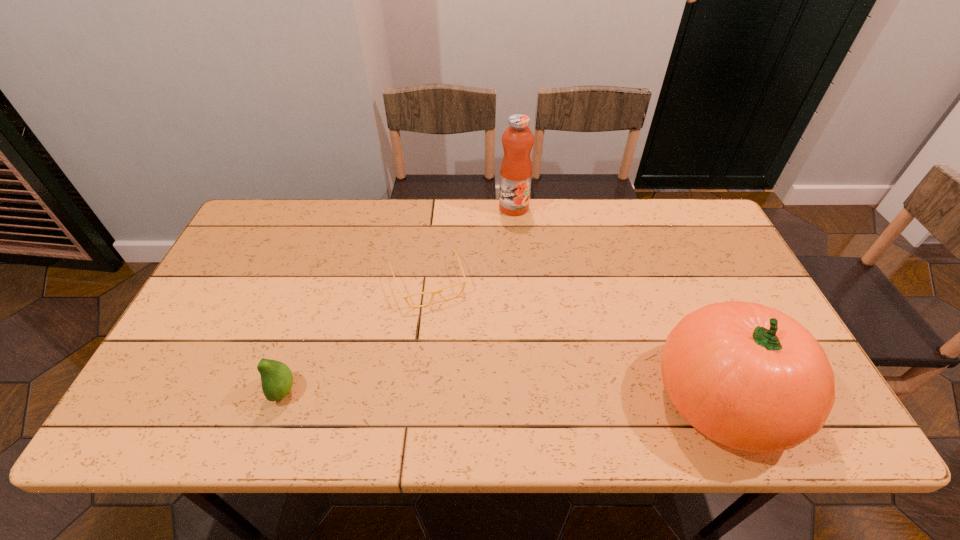
Where is `pumpkin at the near edge`? pumpkin at the near edge is located at coordinates (748, 376).

Identify the location of object positioned at the right edge. The image size is (960, 540). [748, 376].

I want to click on object situated at the near right corner, so click(748, 376).

Find the location of a particular element. The image size is (960, 540). vacant space at the far edge of the desktop is located at coordinates (407, 202).

The image size is (960, 540). In the image, there is a desktop. In order to click on vacant space at the near edge in this screenshot , I will do `click(651, 377)`.

In the image, there is a desktop. Identify the location of vacant area at the left edge. This screenshot has height=540, width=960. (276, 265).

In order to click on vacant space at the far left corner of the desktop in this screenshot , I will do `click(254, 208)`.

Image resolution: width=960 pixels, height=540 pixels. Find the location of `free space at the far right corner of the desktop`. free space at the far right corner of the desktop is located at coordinates click(x=723, y=241).

The image size is (960, 540). I want to click on empty space between the third shortest object and the second object from right to left, so click(618, 303).

Find the location of a particular element. The image size is (960, 540). free spot between the shortest object and the farthest object is located at coordinates (471, 245).